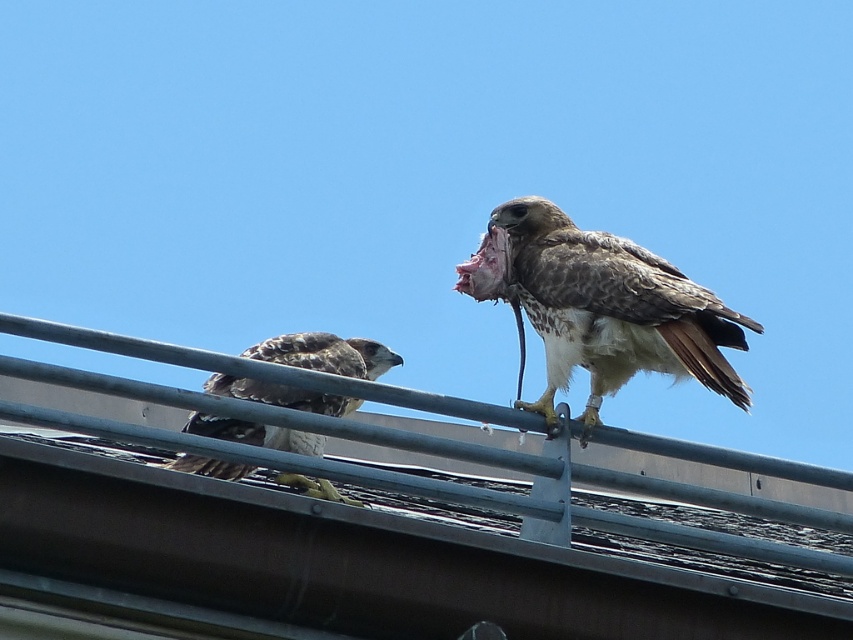
Question: Does metallic gray roof at center have a greater width compared to brown speckled feathers at upper right?

Choices:
 (A) no
 (B) yes

Answer: (B)

Question: Which object is positioned farthest from the brown speckled feathers at upper right?

Choices:
 (A) brown speckled feathers at center
 (B) metallic gray roof at center

Answer: (A)

Question: Considering the real-world distances, which object is farthest from the metallic gray roof at center?

Choices:
 (A) brown speckled feathers at upper right
 (B) brown speckled feathers at center

Answer: (B)

Question: Is metallic gray roof at center thinner than brown speckled feathers at upper right?

Choices:
 (A) no
 (B) yes

Answer: (A)

Question: Considering the real-world distances, which object is farthest from the metallic gray roof at center?

Choices:
 (A) brown speckled feathers at upper right
 (B) brown speckled feathers at center

Answer: (B)

Question: Does metallic gray roof at center have a smaller size compared to brown speckled feathers at upper right?

Choices:
 (A) no
 (B) yes

Answer: (A)